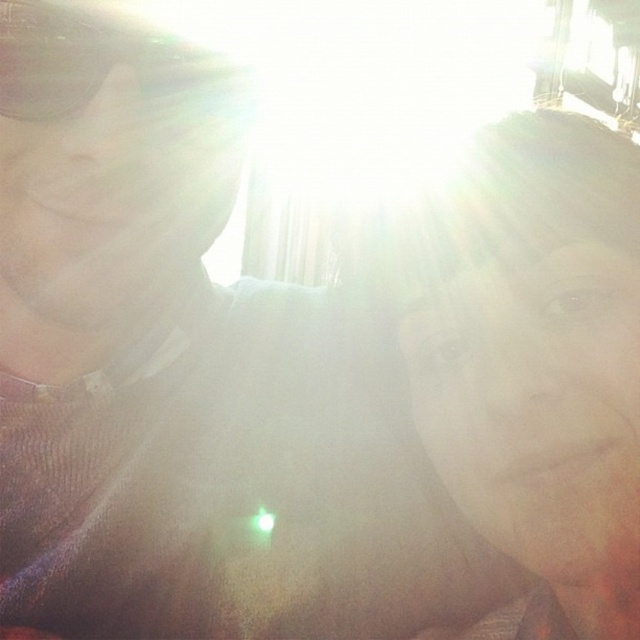
Question: Considering the relative positions of smooth skin face at right and matte black goggles at upper left in the image provided, where is smooth skin face at right located with respect to matte black goggles at upper left?

Choices:
 (A) left
 (B) right

Answer: (B)

Question: Which of the following is the farthest from the observer?

Choices:
 (A) matte black goggles at upper left
 (B) smooth skin face at right

Answer: (B)

Question: Does smooth skin face at right have a larger size compared to matte black goggles at upper left?

Choices:
 (A) no
 (B) yes

Answer: (B)

Question: Is smooth skin face at right further to the viewer compared to matte black goggles at upper left?

Choices:
 (A) no
 (B) yes

Answer: (B)